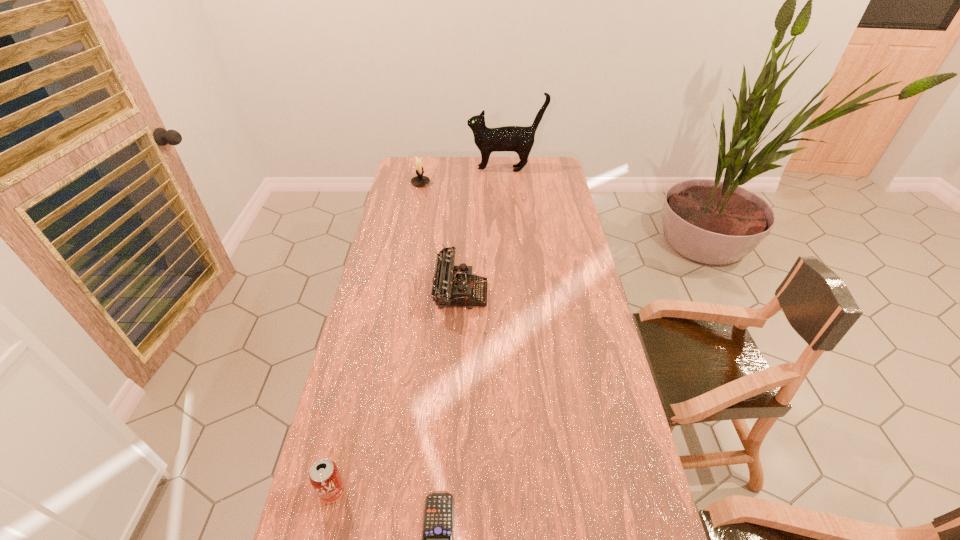
In the image, there is a desktop. At what (x,y) coordinates should I click in order to perform the action: click on vacant space at the left edge. Please return your answer as a coordinate pair (x, y). This screenshot has height=540, width=960. Looking at the image, I should click on [359, 494].

Image resolution: width=960 pixels, height=540 pixels. I want to click on free space at the right edge, so click(540, 182).

Where is `free space between the third nearest object and the soda can`? The image size is (960, 540). free space between the third nearest object and the soda can is located at coordinates (396, 392).

Where is `vacant area that lies between the typewriter and the tallest object`? The height and width of the screenshot is (540, 960). vacant area that lies between the typewriter and the tallest object is located at coordinates (483, 231).

I want to click on vacant area that lies between the third farthest object and the soda can, so click(x=396, y=392).

Where is `vacant area between the tallest object and the fourth shortest object`? The width and height of the screenshot is (960, 540). vacant area between the tallest object and the fourth shortest object is located at coordinates (463, 176).

In order to click on free space between the soda can and the farthest object in this screenshot , I will do `click(420, 330)`.

Where is `empty space between the soda can and the typewriter`? Image resolution: width=960 pixels, height=540 pixels. empty space between the soda can and the typewriter is located at coordinates (396, 392).

Where is `free space between the soda can and the tallest object`? This screenshot has height=540, width=960. free space between the soda can and the tallest object is located at coordinates (420, 330).

Identify which object is located as the second nearest to the candle holder. Please provide its 2D coordinates. Your answer should be formatted as a tuple, i.e. [(x, y)], where the tuple contains the x and y coordinates of a point satisfying the conditions above.

[(452, 285)]